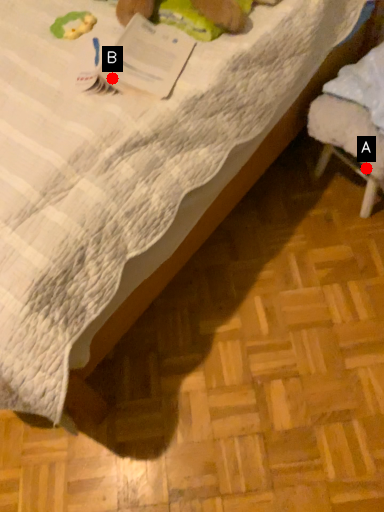
Question: Two points are circled on the image, labeled by A and B beside each circle. Which point is farther from the camera taking this photo?

Choices:
 (A) A is further
 (B) B is further

Answer: (A)